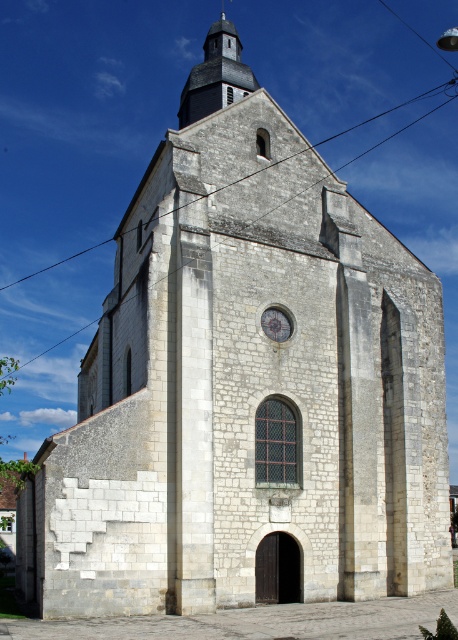
What do you see at coordinates (216, 74) in the screenshot? I see `smooth gray spire at upper center` at bounding box center [216, 74].

Who is more distant from viewer, (185, 108) or (288, 317)?

Positioned behind is point (185, 108).

Does point (228, 76) come in front of point (288, 326)?

No, (228, 76) is behind (288, 326).

I want to click on smooth gray spire at upper center, so click(x=216, y=74).